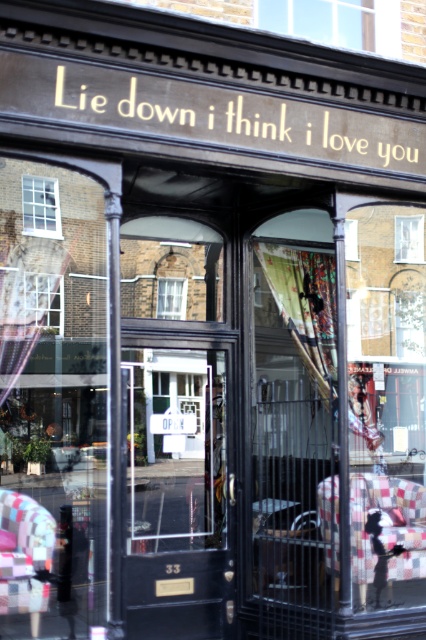
Question: Which point appears closest to the camera in this image?

Choices:
 (A) pos(181,284)
 (B) pos(54,292)

Answer: (B)

Question: Is transparent glass window at center wider than clear glass window at center?

Choices:
 (A) no
 (B) yes

Answer: (B)

Question: Which point is closer to the camera?

Choices:
 (A) clear glass window at upper center
 (B) clear glass window at center
 (C) clear glass window at upper left
 (D) transparent glass window at center

Answer: (C)

Question: Which object is the closest to the clear glass window at center?

Choices:
 (A) white glass window at upper left
 (B) clear glass window at upper left

Answer: (B)

Question: Is the position of white glass window at upper left more distant than that of clear glass window at center?

Choices:
 (A) no
 (B) yes

Answer: (A)

Question: Does clear glass window at upper left appear on the right side of clear glass window at center?

Choices:
 (A) yes
 (B) no

Answer: (B)